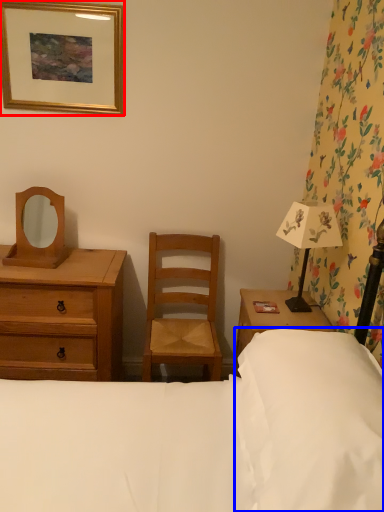
Question: Which object is closer to the camera taking this photo, picture frame (highlighted by a red box) or pillow (highlighted by a blue box)?

Choices:
 (A) picture frame
 (B) pillow

Answer: (B)